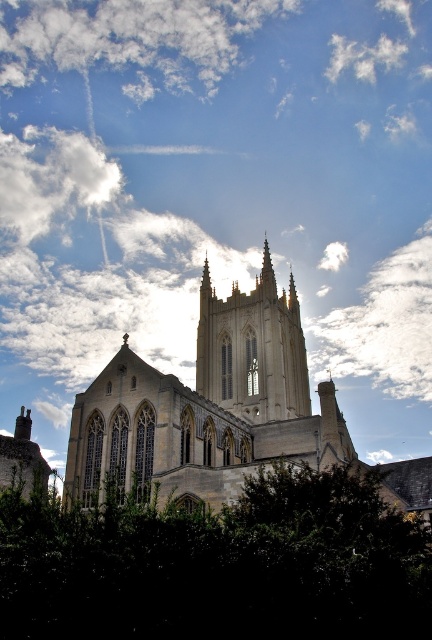
Question: Is golden stone church at center thinner than white fluffy cloud at upper right?

Choices:
 (A) no
 (B) yes

Answer: (A)

Question: Is golden stone church at center positioned before white stone tower at center?

Choices:
 (A) yes
 (B) no

Answer: (A)

Question: Is golden stone church at center positioned in front of white fluffy cloud at upper right?

Choices:
 (A) no
 (B) yes

Answer: (B)

Question: Which point is farther to the camera?

Choices:
 (A) (386, 614)
 (B) (165, 442)
 (C) (384, 298)

Answer: (C)

Question: Based on their relative distances, which object is farther from the white stone tower at center?

Choices:
 (A) white fluffy cloud at upper right
 (B) white fluffy cloud at upper center
 (C) golden stone church at center
 (D) green leafy tree at lower center

Answer: (B)

Question: Which of the following is the farthest from the observer?

Choices:
 (A) white fluffy cloud at upper right
 (B) white fluffy cloud at upper center
 (C) green leafy tree at lower center
 (D) golden stone church at center

Answer: (B)